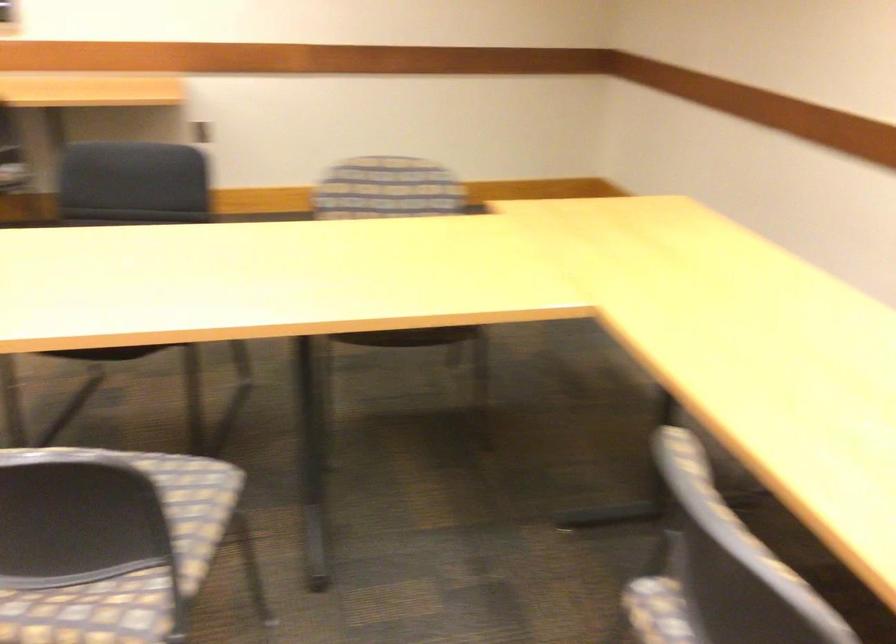
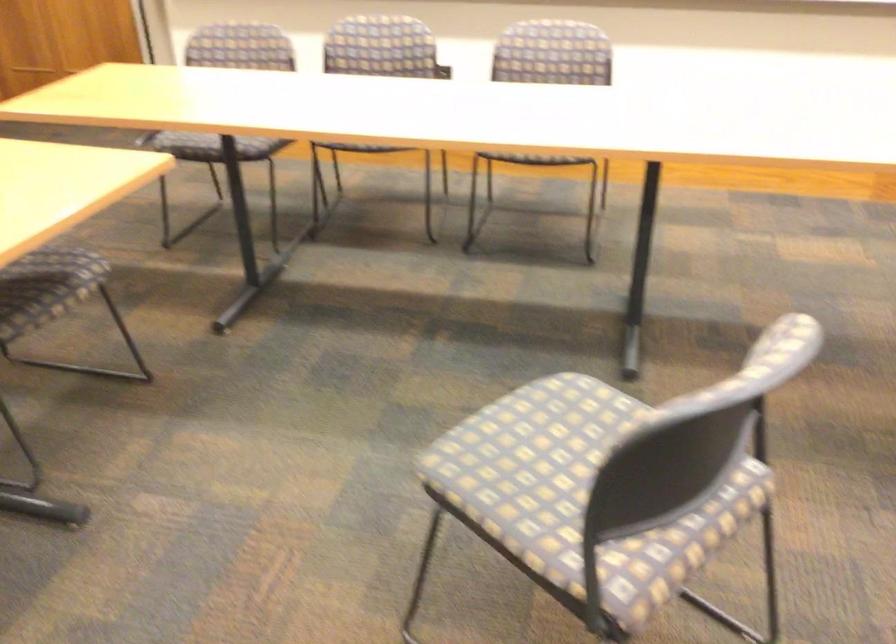
How did the camera likely rotate?

The camera's rotation is toward left-down.